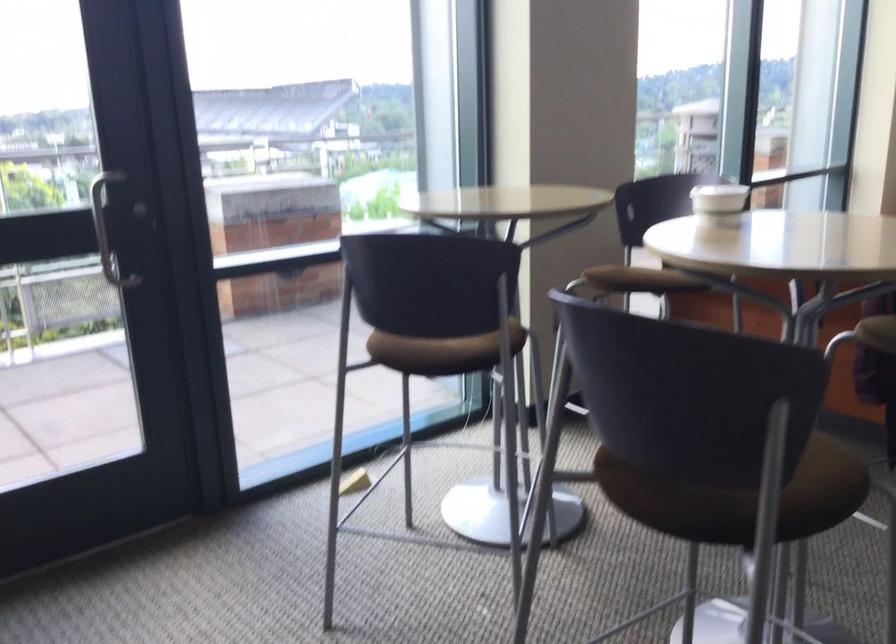
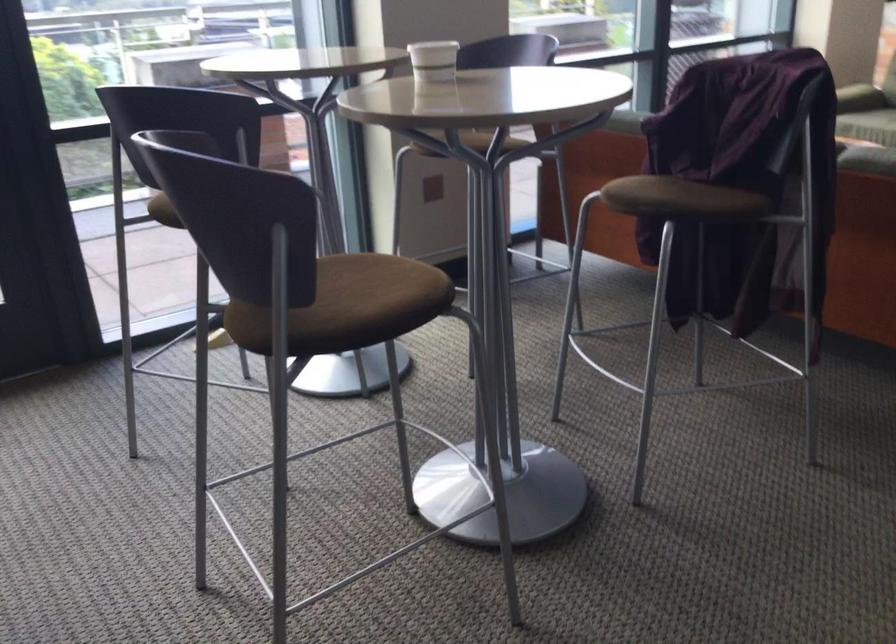
Locate, in the second image, the point that corresponds to point (711, 201) in the first image.

(433, 61)